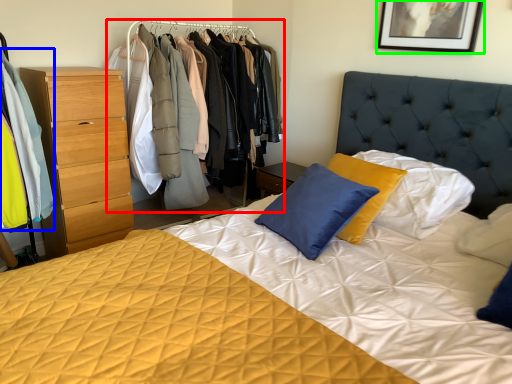
Question: Estimate the real-world distances between objects in this image. Which object is closer to dresser (highlighted by a red box), clothing (highlighted by a blue box) or picture frame (highlighted by a green box)?

Choices:
 (A) clothing
 (B) picture frame

Answer: (A)